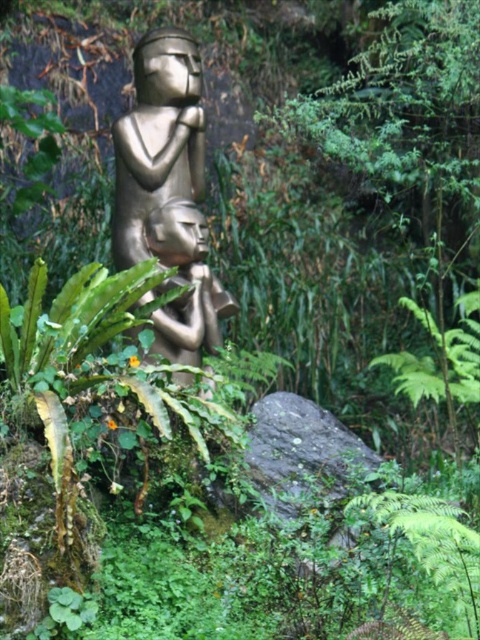
You are a tour guide explaining the statue to visitors. You want to point out a specific location on the statue. Where exactly is the point at coordinates point (168, 193) located?

The point at coordinates point (168, 193) is on the gold polished statue at center.

You are an art curator planning to display the gold polished statue at center and the gold metallic figurine at center in a gallery. The gallery has a 3 meter high ceiling. Can both items be displayed vertically without touching the ceiling?

The gold polished statue at center is larger than the gold metallic figurine at center. However, without knowing their exact heights, it is impossible to determine if they will fit under the 3 meter ceiling. Additional measurements are required.